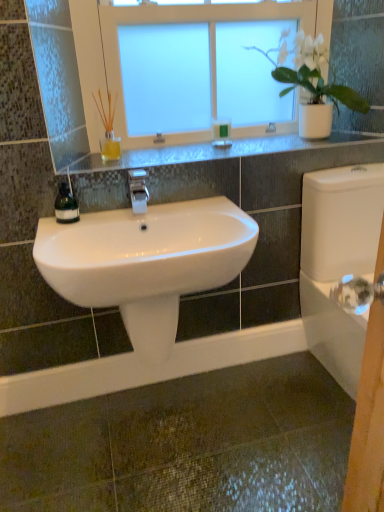
This screenshot has height=512, width=384. In order to click on vacant area situated to the left side of green matte soap at upper center in this screenshot , I will do `click(176, 150)`.